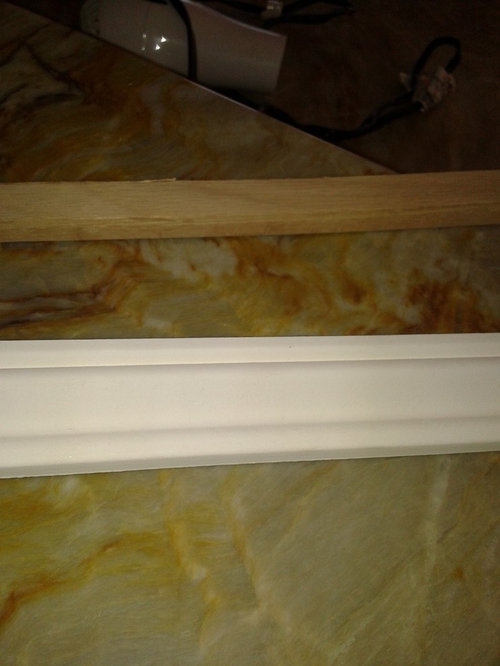
Locate an element on the screen. This screenshot has width=500, height=666. plaster cornice is located at coordinates (272, 391).